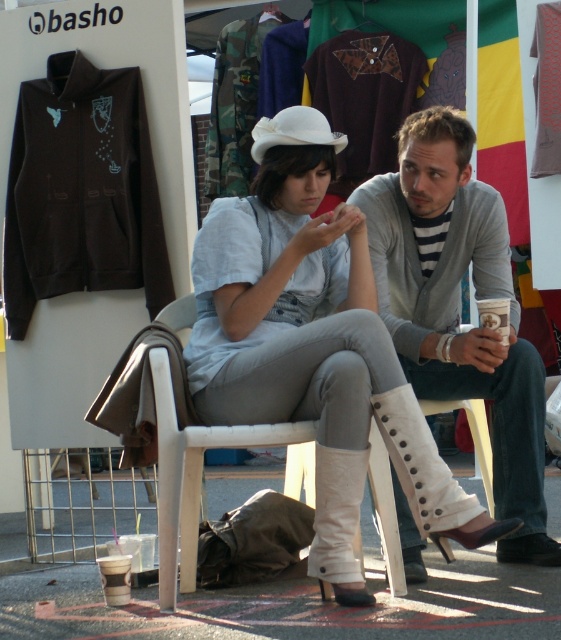
Can you confirm if gray knit sweater at center is positioned above white felt hat at upper center?

Incorrect, gray knit sweater at center is not positioned above white felt hat at upper center.

Locate an element on the screen. This screenshot has width=561, height=640. gray knit sweater at center is located at coordinates (459, 307).

This screenshot has width=561, height=640. Identify the location of gray knit sweater at center. (459, 307).

Which is behind, point (223, 262) or point (168, 593)?

The point (223, 262) is more distant.

Does white matte boots at center appear under white plastic chair at center?

Incorrect, white matte boots at center is not positioned below white plastic chair at center.

Is point (315, 332) closer to viewer compared to point (153, 384)?

Yes, it is.

You are a GUI agent. You are given a task and a screenshot of the screen. Output one action in this format:
    pyautogui.click(x=<x>, y=<y>)
    Task: Click on the white matte boots at center
    The image size is (561, 640).
    Given the screenshot: What is the action you would take?
    pyautogui.click(x=312, y=353)

Does point (324, 164) lie in front of point (342, 145)?

No, (324, 164) is further to viewer.

Is white matte boots at center to the right of white felt hat at upper center from the viewer's perspective?

Yes, white matte boots at center is to the right of white felt hat at upper center.

Which is in front, point (402, 401) or point (310, 116)?

Positioned in front is point (402, 401).

In order to click on white matte boots at center in this screenshot , I will do `click(312, 353)`.